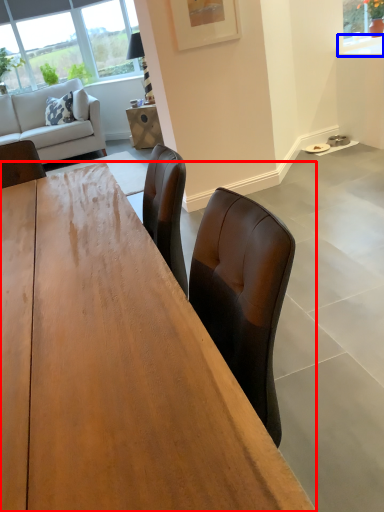
Question: Among these objects, which one is farthest to the camera, desk (highlighted by a red box) or counter top (highlighted by a blue box)?

Choices:
 (A) desk
 (B) counter top

Answer: (B)